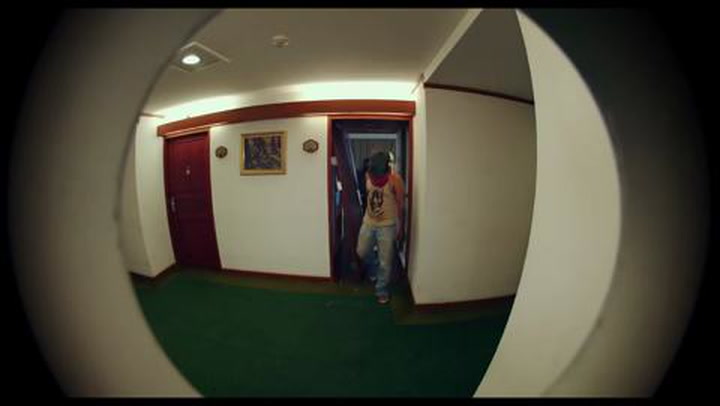
Where is `doorknob`? This screenshot has width=720, height=406. doorknob is located at coordinates (170, 202).